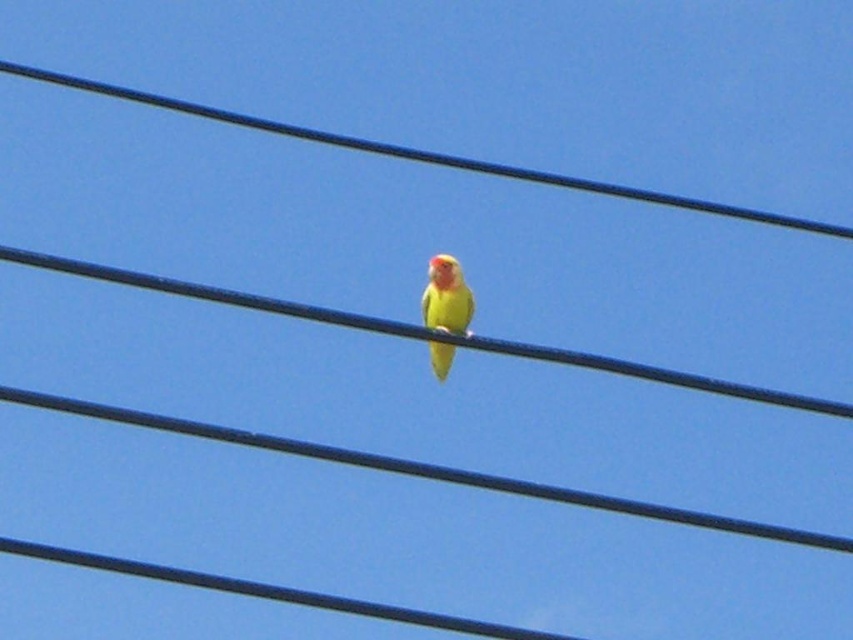
You are a photographer trying to capture the yellow matte parrot at center perched on the black wire at center. If you want to focus on the bird without the wire being too prominent, which object should you adjust your camera settings to blur more?

The black wire at center is bigger than the yellow matte parrot at center, so to blur the wire more, adjust the camera settings to focus on the smaller yellow matte parrot at center and use a wider aperture to create a shallower depth of field, making the larger black wire at center appear more blurred in the background.

You are a birdwatcher trying to identify the exact location of the black wire in the image. The coordinates given are point (422, 154). Can you confirm if this point corresponds to the location of the black wire at center?

Yes, the point (422, 154) marks the black wire at center as stated in the description.

You are a birdwatcher observing the scene. You notice the black wire at center and the yellow matte parrot at center. Which object is located above the other?

The black wire at center is positioned over the yellow matte parrot at center, meaning it is above the parrot.